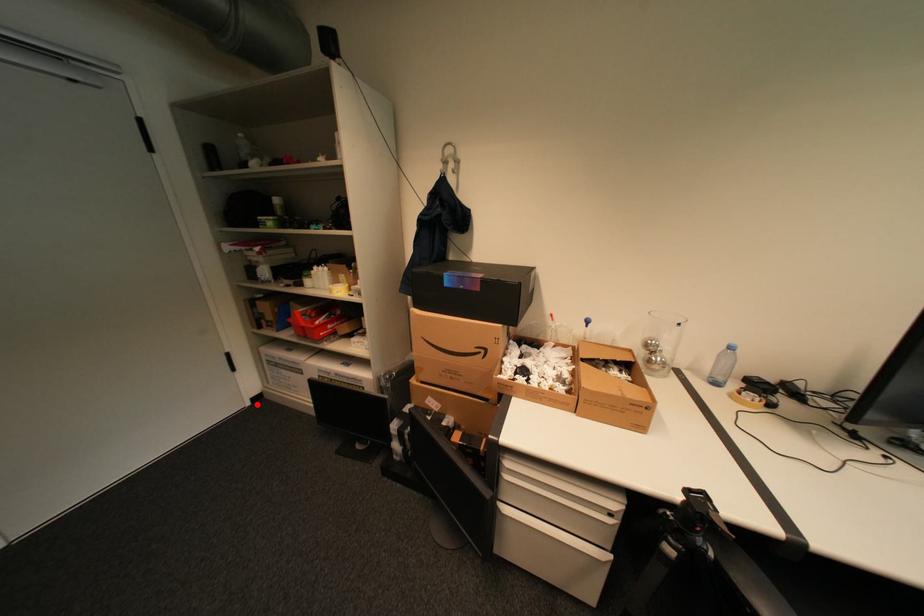
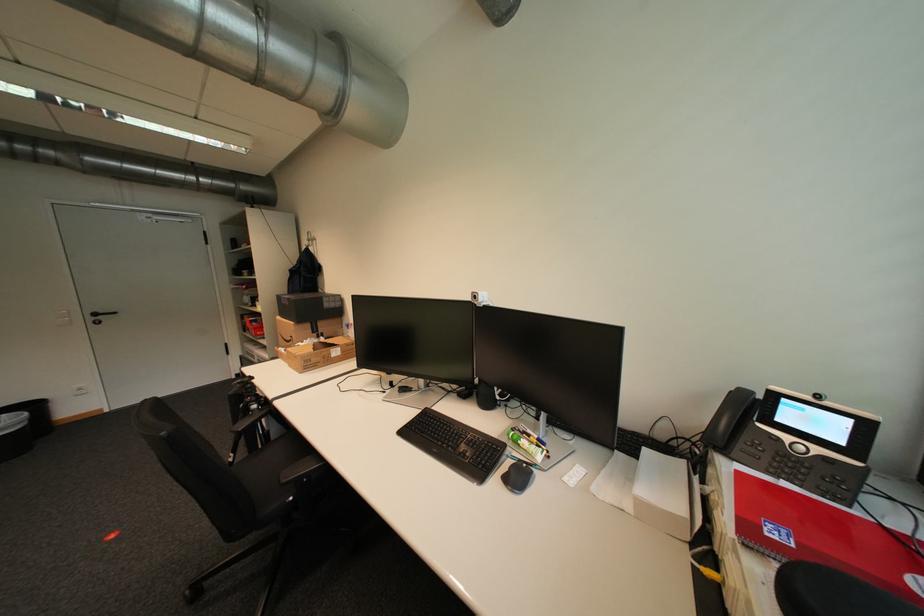
Question: I am providing you with two images of the same scene from different viewpoints. Given a red point in image1, look at the same physical point in image2. Is it:

Choices:
 (A) Closer to the viewpoint
 (B) Farther from the viewpoint

Answer: (B)